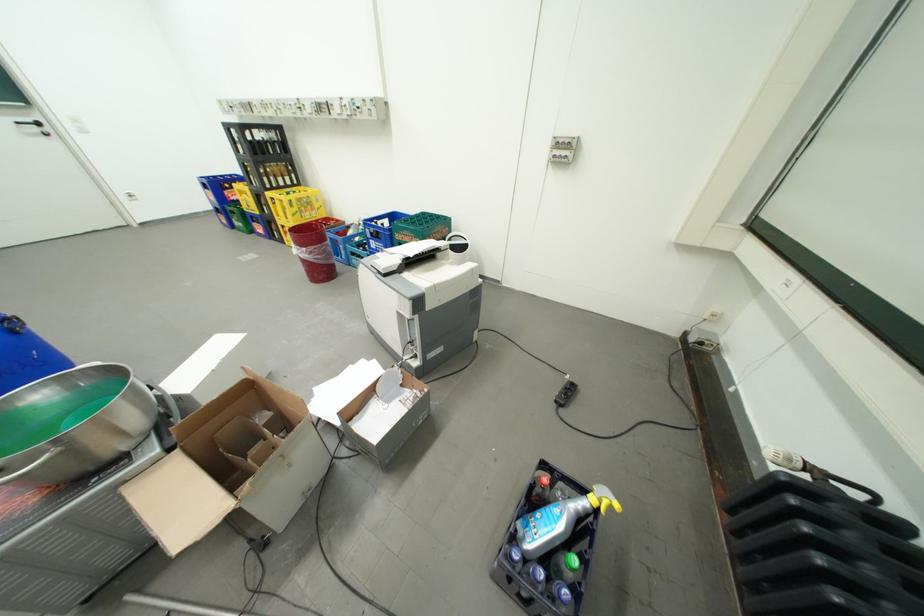
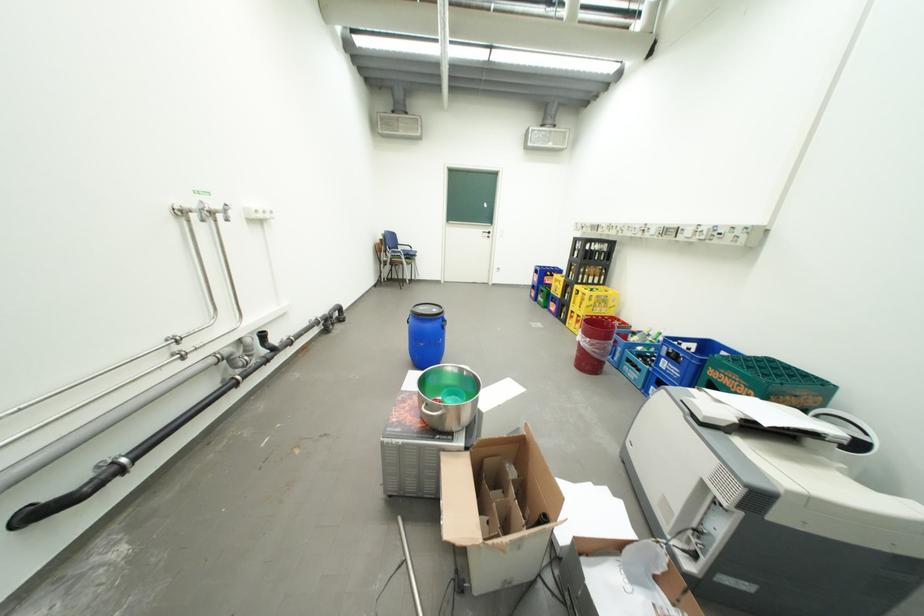
In the second image, find the point that corresponds to point 424,238 in the first image.

(756, 387)